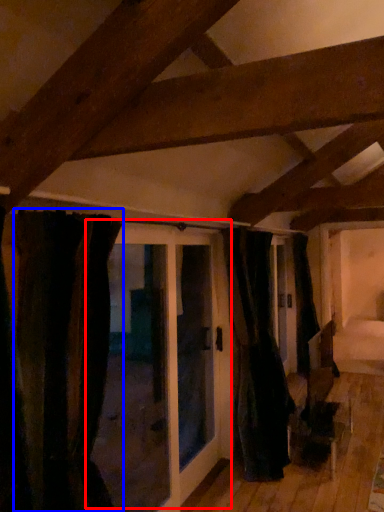
Question: Among these objects, which one is farthest to the camera, door (highlighted by a red box) or curtain (highlighted by a blue box)?

Choices:
 (A) door
 (B) curtain

Answer: (A)